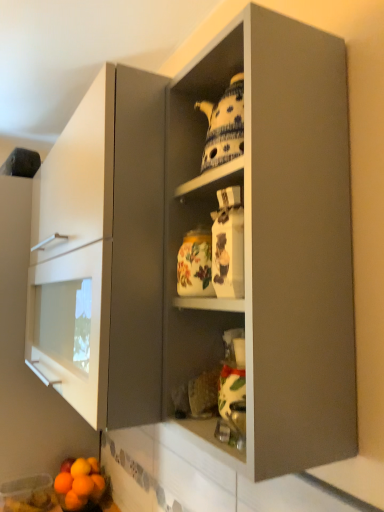
Question: Based on their sizes in the image, would you say orange matte at lower left, the 1th orange viewed from the left, is bigger or smaller than orange matte at lower left, arranged as the first orange when viewed from the right?

Choices:
 (A) small
 (B) big

Answer: (B)

Question: Is point (69, 483) positioned closer to the camera than point (96, 486)?

Choices:
 (A) closer
 (B) farther

Answer: (A)

Question: Which object is the closest to the porcelain teapot at upper center?

Choices:
 (A) orange matte at lower left, which is the second orange in right-to-left order
 (B) orange matte at lower left, placed as the third orange when sorted from left to right
 (C) orange matte at lower left, the 4th orange when ordered from right to left
 (D) smooth orange grapefruit at lower left
 (E) orange matte at lower left, the 1th orange viewed from the left

Answer: (D)

Question: Which of these objects is positioned farthest from the orange matte at lower left, placed as the third orange when sorted from left to right?

Choices:
 (A) orange matte at lower left, which is the second orange in right-to-left order
 (B) orange matte at lower left, which ranks as the fifth orange in right-to-left order
 (C) orange matte at lower left, the 4th orange when ordered from right to left
 (D) smooth orange grapefruit at lower left
 (E) porcelain teapot at upper center

Answer: (E)